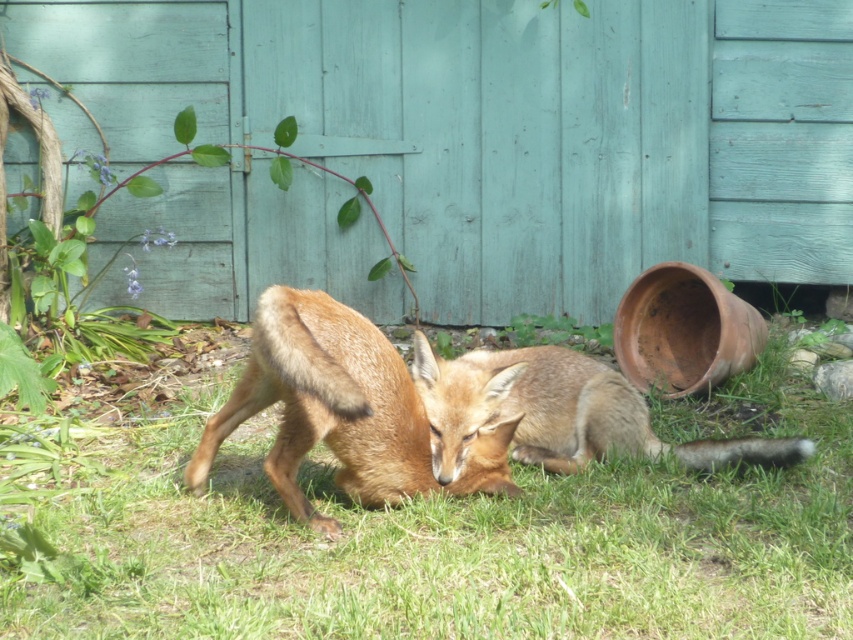
You are standing in the scene and want to place a small flag at the closest point to you between point (300,344) and point (467,444). Which point should you choose?

Point (300,344) is closer to the viewer than point (467,444), so you should choose point (300,344) to place the flag.

You are a photographer trying to capture a photo of the brown fur fox at center and the green grass at center. Since you want both subjects to be in focus, you need to know their relative positions. Which object is positioned to the right of the other?

The green grass at center is to the right of brown fur fox at center, so the grass is positioned to the right of the fox.